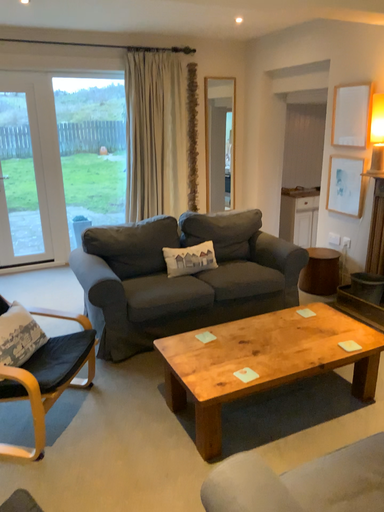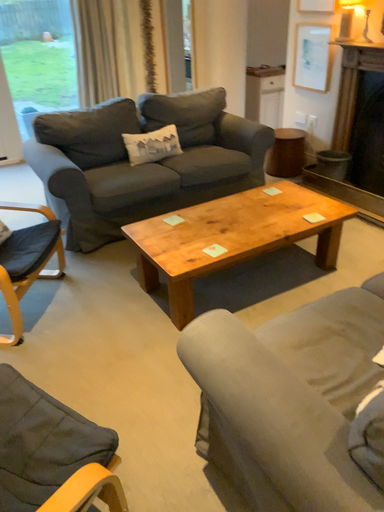
Question: Which way did the camera rotate in the video?

Choices:
 (A) rotated upward
 (B) rotated downward

Answer: (B)